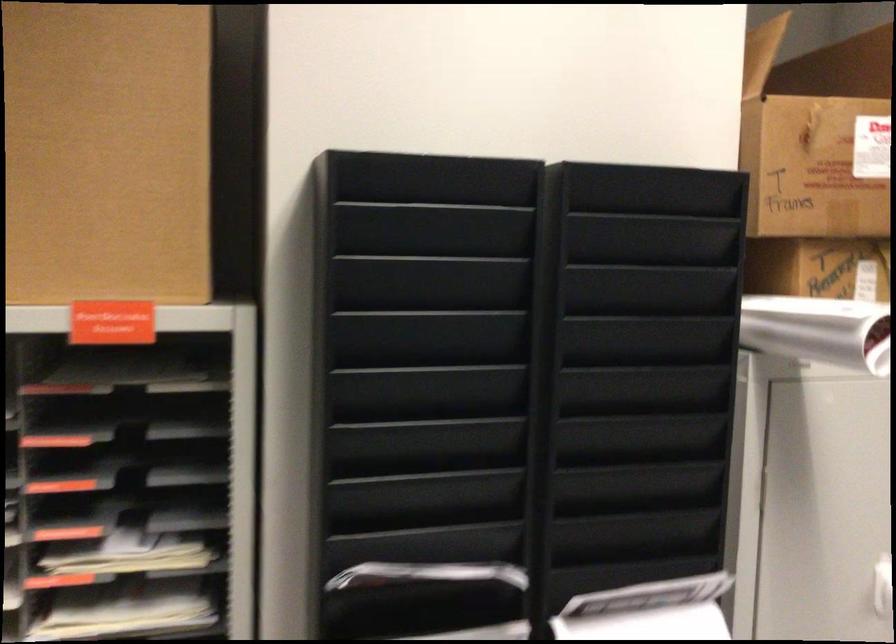
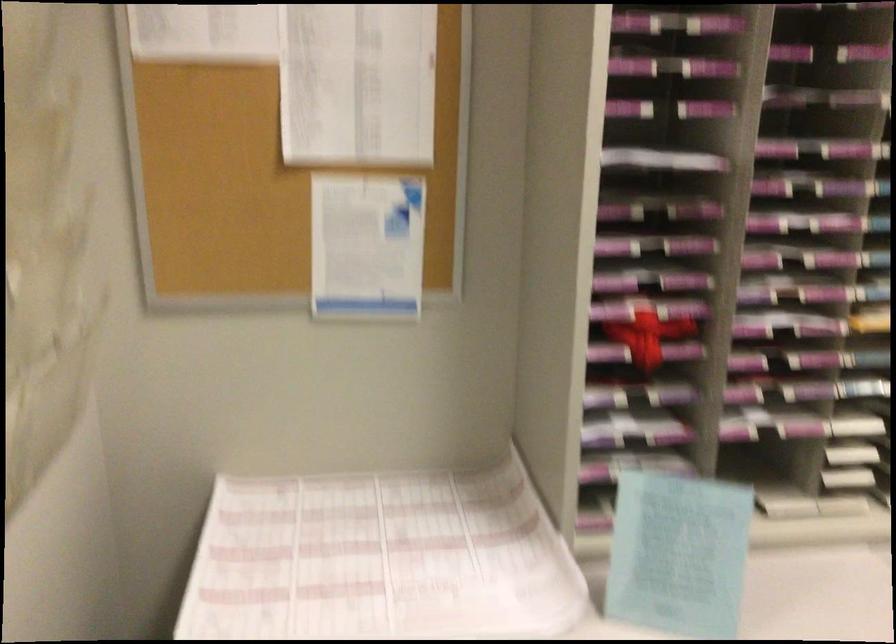
Question: Which direction would the cameraman need to move to produce the second image? Reply with the corresponding letter.

Choices:
 (A) Left
 (B) Right
 (C) Forward
 (D) Backward

Answer: (A)